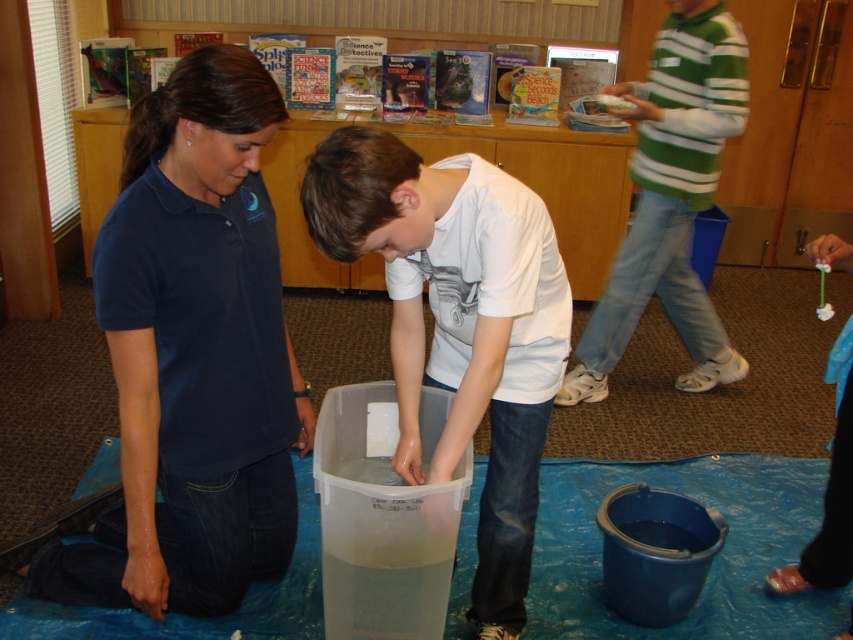
Based on the photo, can you confirm if dark blue cotton shirt at center is positioned below green striped sweater at upper right?

Correct, dark blue cotton shirt at center is located below green striped sweater at upper right.

What are the coordinates of `dark blue cotton shirt at center` in the screenshot? It's located at (192, 355).

Who is more distant from viewer, [222,566] or [515,524]?

Point [515,524]

Can you confirm if dark blue cotton shirt at center is smaller than white matte shirt at center?

No.

Is point (248, 336) positioned behind point (401, 193)?

Yes, point (248, 336) is behind point (401, 193).

I want to click on dark blue cotton shirt at center, so click(192, 355).

Does white matte shirt at center appear on the left side of green striped sweater at upper right?

Yes, white matte shirt at center is to the left of green striped sweater at upper right.

Can you confirm if white matte shirt at center is smaller than green striped sweater at upper right?

Yes.

Which is behind, point (482, 374) or point (628, 248)?

Positioned behind is point (628, 248).

Find the location of a particular element. This screenshot has height=640, width=853. white matte shirt at center is located at coordinates (457, 324).